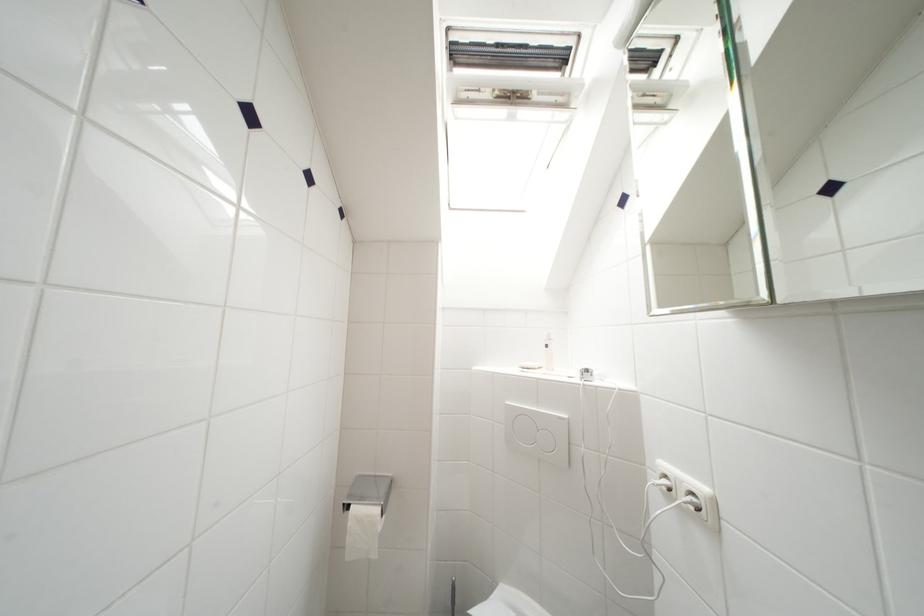
This screenshot has width=924, height=616. Describe the element at coordinates (691, 500) in the screenshot. I see `the small flush button` at that location.